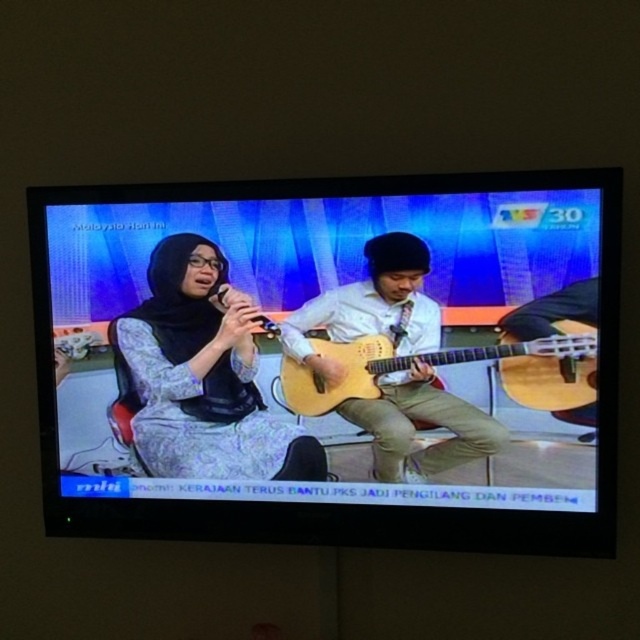
You are a photographer trying to capture a closeup of the singer and the guitarist in the center of the TV screen. Given that your camera can only focus on objects that are at least 10 inches tall, can you confirm if both the patterned fabric hijab at center and the light wood acoustic guitar at center are within the focus range?

The patterned fabric hijab at center is larger in size than the light wood acoustic guitar at center. Since the hijab is larger, it is likely taller than 10 inches. However, without specific height measurements for the guitar, we cannot be certain if it meets the 10 inch requirement. Please provide more details about the guitar.

You are a photographer setting up for a closeup shot of the performers. You need to decide which object, the matte wood guitar at center or the patterned fabric hijab at center, requires more space in the frame to avoid cropping. Which one should you prioritize?

The matte wood guitar at center might be wider than patterned fabric hijab at center, so you should prioritize including the matte wood guitar at center in the frame to avoid cropping.

You are watching the live performance on the television screen. The woman wearing the patterned fabric hijab at center is positioned at coordinates 0.589 on the x and 0.314 on the y. Can you determine if she is closer to the left or right side of the screen?

The patterned fabric hijab at center is located at point (200, 376). Since the x coordinate is 0.589, which is closer to 1 than to 0, she is positioned closer to the right side of the screen.